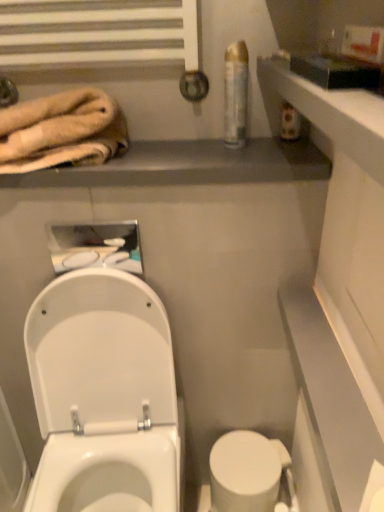
Identify the location of vacant point to the right of clear plastic can at upper right. This screenshot has height=512, width=384. (279, 147).